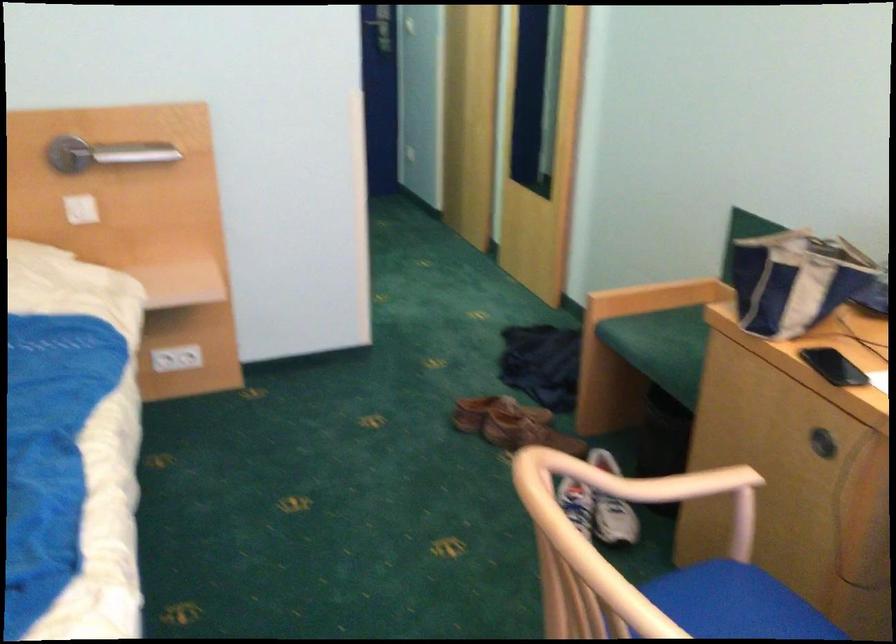
Find where to sit the green sofa sitting surface. Please return your answer as a coordinate pair (x, y).

(661, 346)